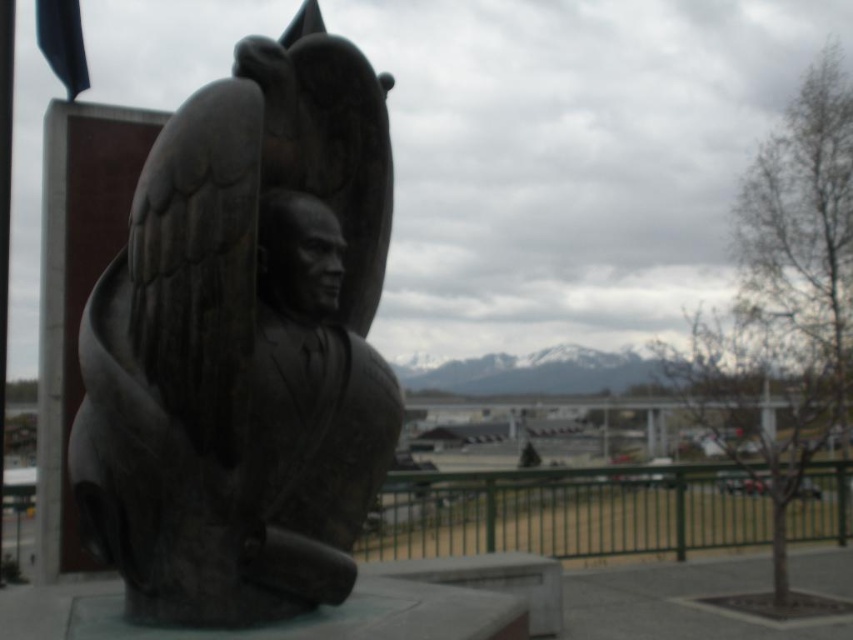
Question: Can you confirm if bronze statue at center is bigger than green metal fence at lower center?

Choices:
 (A) yes
 (B) no

Answer: (A)

Question: Is bronze statue at center above green metal fence at lower center?

Choices:
 (A) yes
 (B) no

Answer: (A)

Question: Is bronze statue at center below green metal fence at lower center?

Choices:
 (A) no
 (B) yes

Answer: (A)